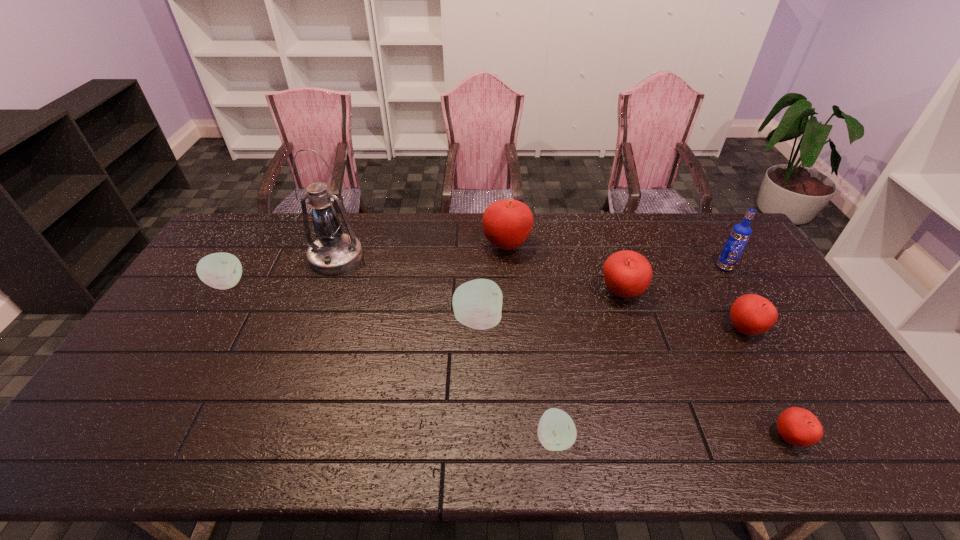
You are a GUI agent. You are given a task and a screenshot of the screen. Output one action in this format:
    pyautogui.click(x=<x>, y=<y>)
    Task: Click on the free region located 0.320m on the front of the third nearest red apple
    
    Given the screenshot: What is the action you would take?
    point(658,404)

Identify the location of vacant space located 0.200m on the back of the leftmost apple. The image size is (960, 540). (256, 235).

I want to click on vacant area situated 0.250m on the front of the second nearest red apple, so (x=801, y=428).

Locate an element on the screen. free space located on the right of the nearest white apple is located at coordinates (738, 438).

Image resolution: width=960 pixels, height=540 pixels. I want to click on vacant space located 0.220m on the back of the nearest red apple, so click(x=742, y=349).

Locate an element on the screen. This screenshot has height=540, width=960. oil lamp at the far edge is located at coordinates (334, 252).

I want to click on apple located in the far edge section of the desktop, so click(507, 223).

Image resolution: width=960 pixels, height=540 pixels. Identify the location of object that is at the left edge. pos(222,270).

The height and width of the screenshot is (540, 960). What are the coordinates of `vodka that is at the right edge` in the screenshot? It's located at (741, 232).

I want to click on apple that is at the right edge, so click(x=751, y=314).